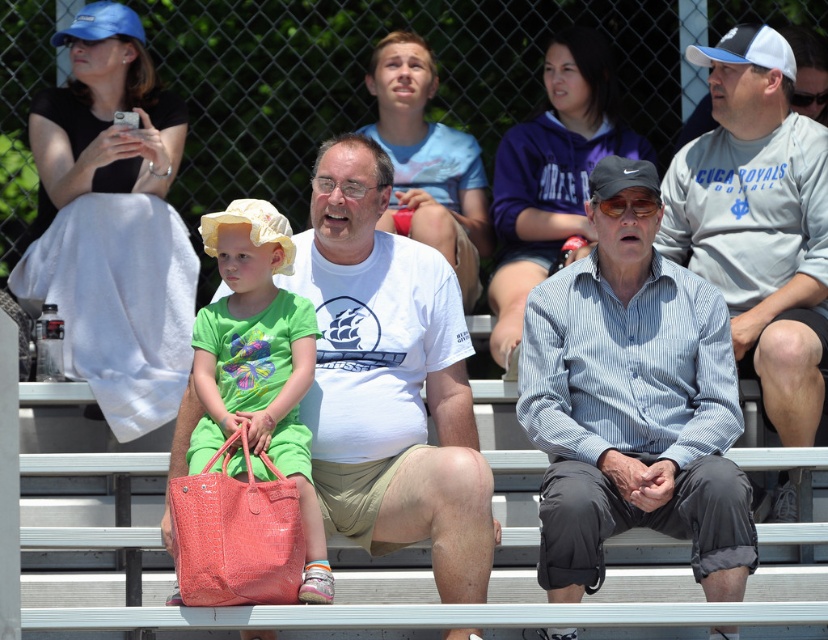
You are standing in the middle of the bleachers and want to find the gray cotton shirt at center. Based on the coordinates provided, in which direction should you look to locate it?

The gray cotton shirt at center is located at coordinates 0.347 on the x axis and 0.917 on the y axis. Since the y coordinate is closer to 1, it is positioned higher up on the bleachers, so you should look upwards to locate it.